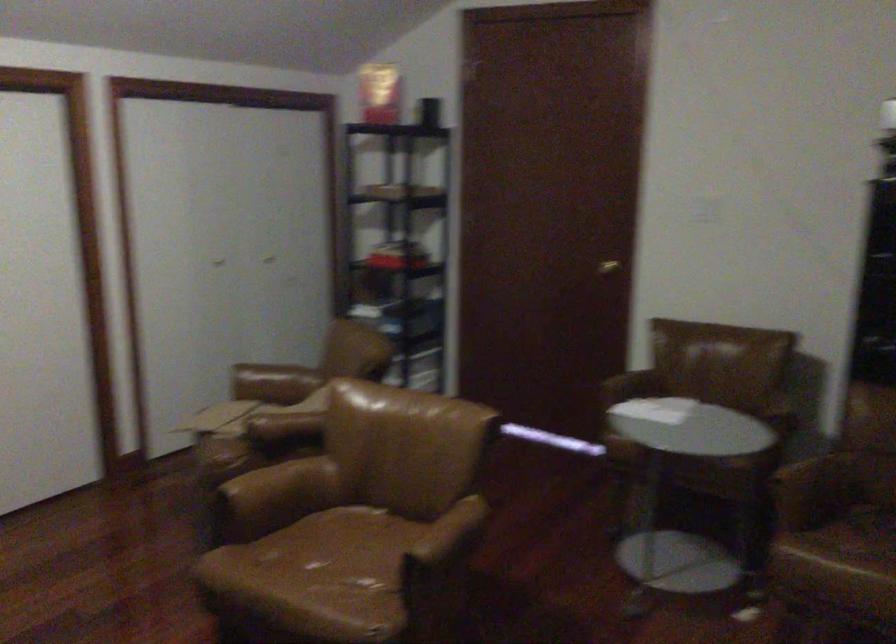
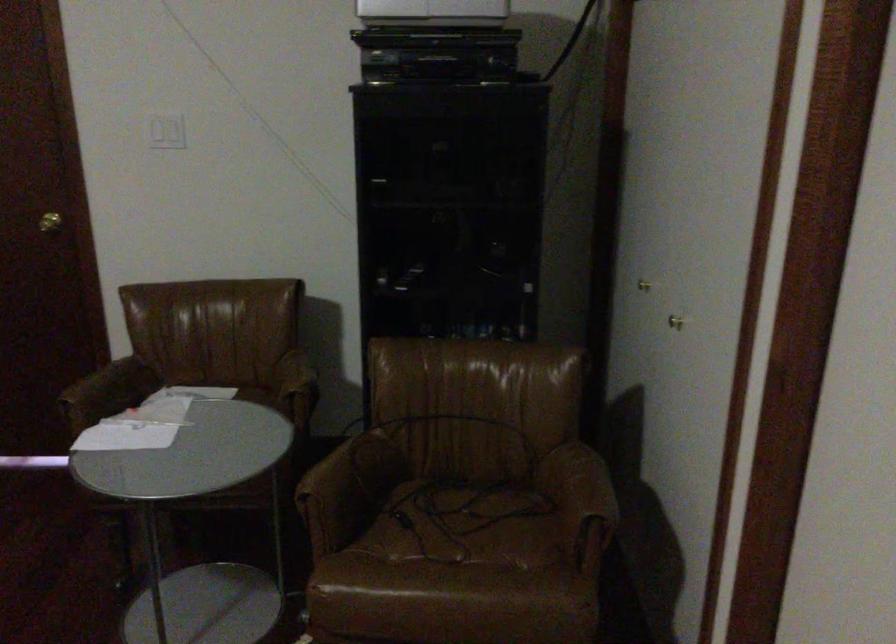
Question: The camera is either moving clockwise (left) or counter-clockwise (right) around the object. The first image is from the beginning of the video and the second image is from the end. Is the camera moving left or right when shooting the video?

Choices:
 (A) Left
 (B) Right

Answer: (A)